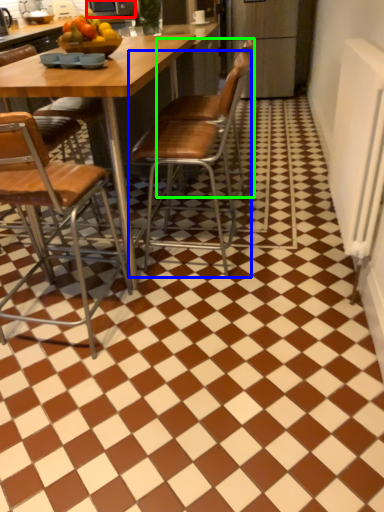
Question: Based on their relative distances, which object is nearer to appliance (highlighted by a red box)? Choose from chair (highlighted by a blue box) and chair (highlighted by a green box).

Choices:
 (A) chair
 (B) chair

Answer: (A)